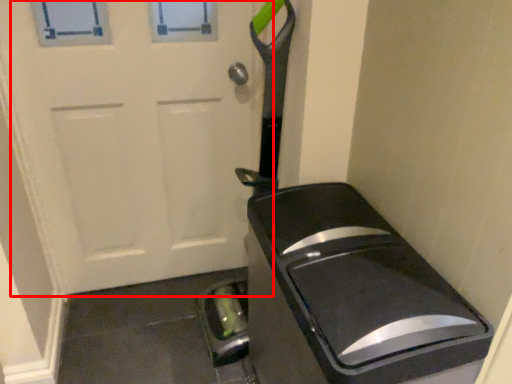
Question: From the image's perspective, where is door (annotated by the red box) located in relation to appliance in the image?

Choices:
 (A) above
 (B) below

Answer: (A)